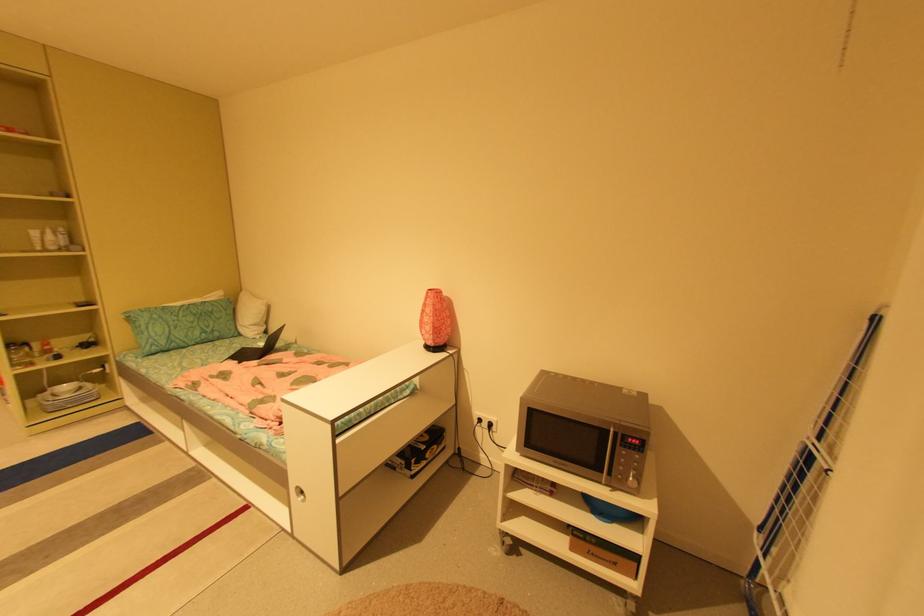
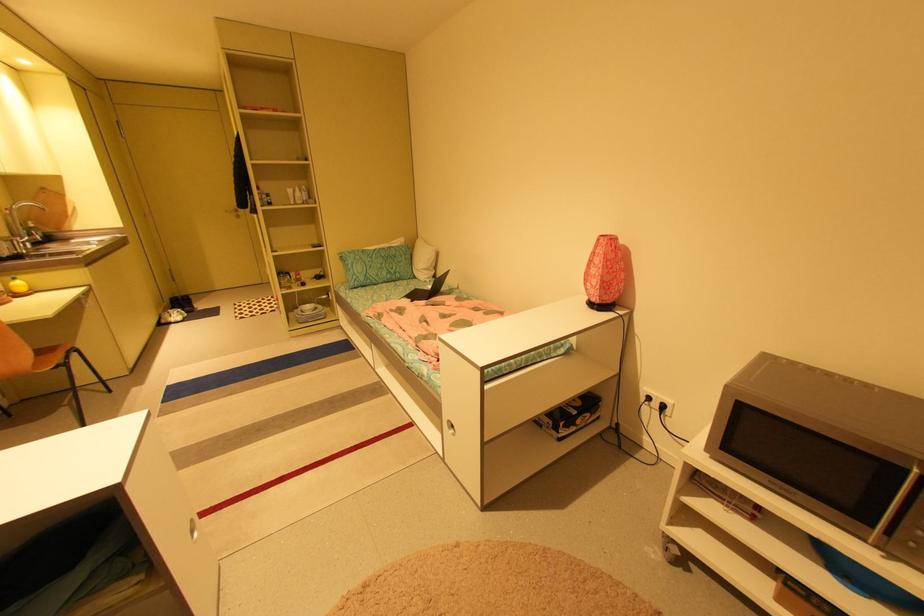
Locate, in the second image, the point that corresponds to [42,233] in the first image.

(296, 191)